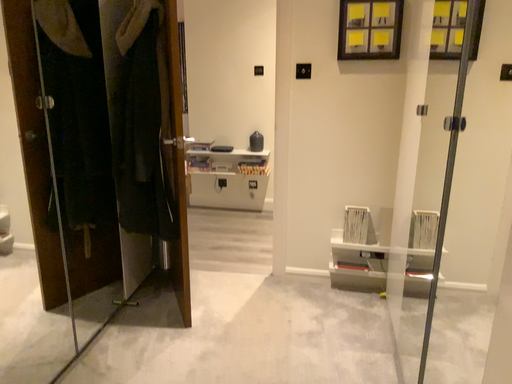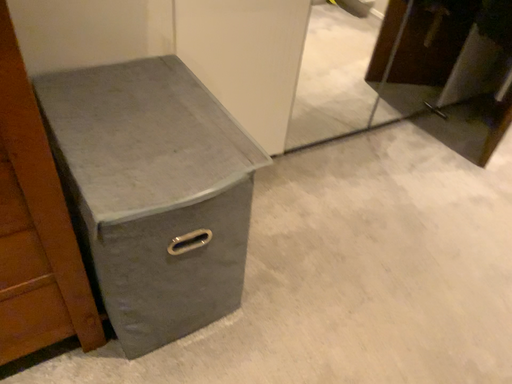
Question: Which way did the camera rotate in the video?

Choices:
 (A) rotated left
 (B) rotated right

Answer: (A)